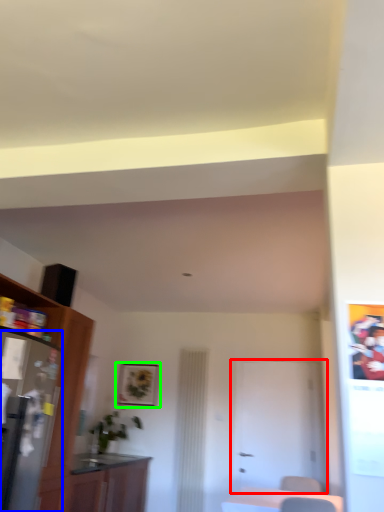
Question: Considering the real-world distances, which object is closest to door (highlighted by a red box)? appliance (highlighted by a blue box) or picture frame (highlighted by a green box).

Choices:
 (A) appliance
 (B) picture frame

Answer: (B)